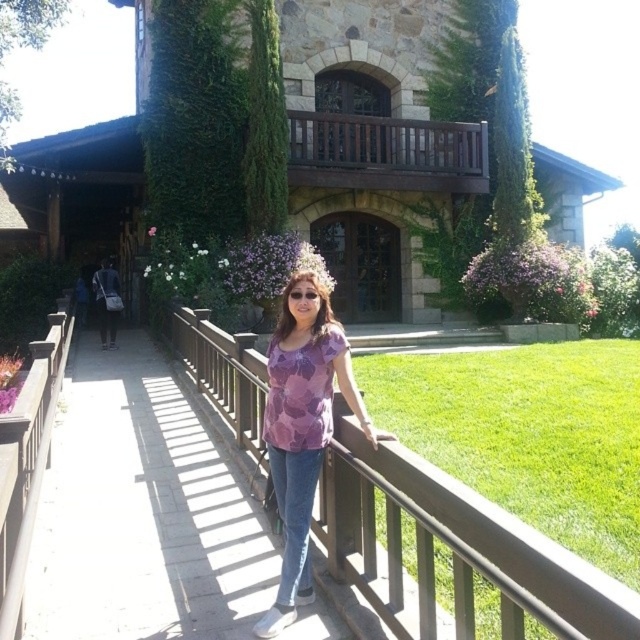
In the scene shown: Between purple printed shirt at center and brown wooden balustrade at upper center, which one is positioned lower?

Positioned lower is purple printed shirt at center.

Does point (316, 365) lie behind point (385, 150)?

No, it is not.

Find the location of `purple printed shirt at center`. purple printed shirt at center is located at coordinates (301, 428).

From the picture: Does wooden bridge at center have a lesser width compared to wooden at center?

In fact, wooden bridge at center might be wider than wooden at center.

Does wooden bridge at center have a greater height compared to wooden at center?

No.

What do you see at coordinates (141, 513) in the screenshot? I see `wooden bridge at center` at bounding box center [141, 513].

In order to click on wooden bridge at center in this screenshot , I will do `click(141, 513)`.

Does wooden at center appear on the left side of brown wooden balustrade at upper center?

Yes, wooden at center is to the left of brown wooden balustrade at upper center.

Can you confirm if wooden at center is positioned to the right of brown wooden balustrade at upper center?

No, wooden at center is not to the right of brown wooden balustrade at upper center.

Who is more distant from viewer, (x=492, y=580) or (x=289, y=156)?

The point (x=289, y=156) is behind.

This screenshot has width=640, height=640. What are the coordinates of `wooden at center` in the screenshot? It's located at (452, 548).